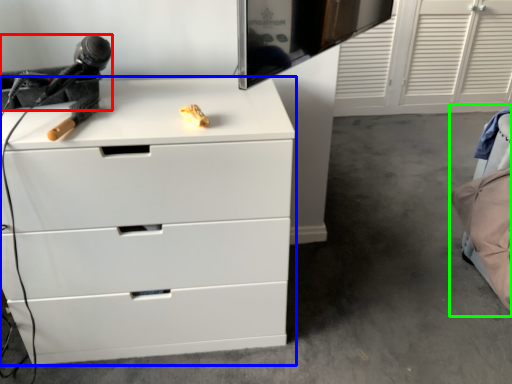
Question: Based on their relative distances, which object is nearer to equipment (highlighted by a red box)? Choose from chest of drawers (highlighted by a blue box) and bed (highlighted by a green box).

Choices:
 (A) chest of drawers
 (B) bed

Answer: (A)